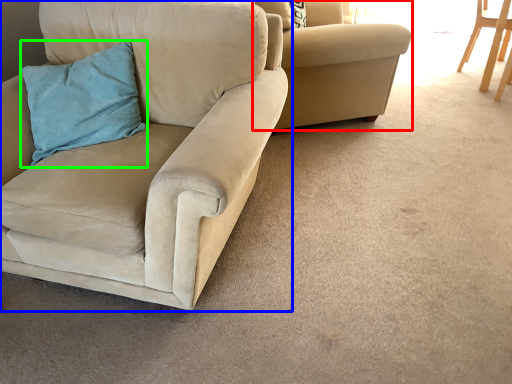
Question: Based on their relative distances, which object is farther from chair (highlighted by a red box)? Choose from chair (highlighted by a blue box) and pillow (highlighted by a green box).

Choices:
 (A) chair
 (B) pillow

Answer: (B)